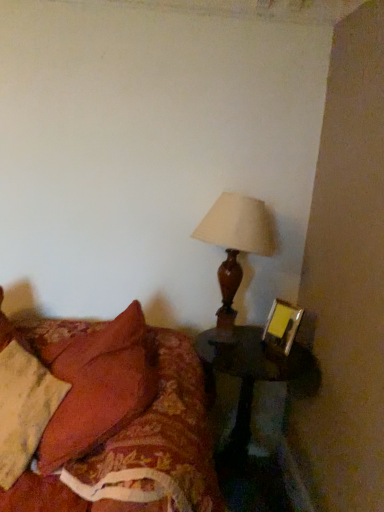
What are the coordinates of `vacant space in front of matte gold picture frame at right` in the screenshot? It's located at (279, 361).